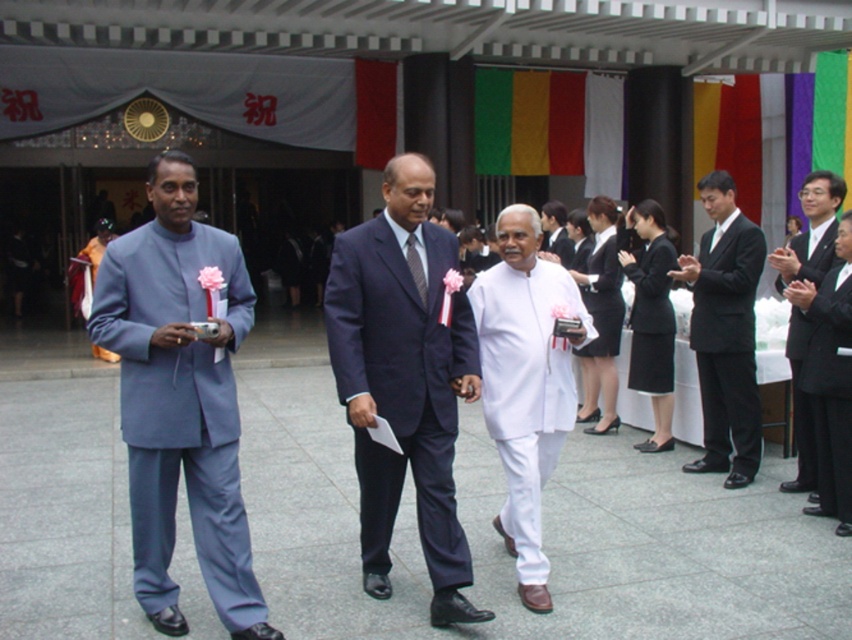
Does dark blue suit at center appear on the right side of black smooth suit at right?

No, dark blue suit at center is not to the right of black smooth suit at right.

Is point (361, 477) farther from camera compared to point (815, 408)?

No, it is in front of (815, 408).

The height and width of the screenshot is (640, 852). Find the location of `dark blue suit at center`. dark blue suit at center is located at coordinates (404, 380).

Does white cotton kurta at center appear on the right side of black smooth suit at right?

No, white cotton kurta at center is not to the right of black smooth suit at right.

Who is lower down, white cotton kurta at center or black smooth suit at right?

Positioned lower is black smooth suit at right.

Where is `white cotton kurta at center`? The image size is (852, 640). white cotton kurta at center is located at coordinates (527, 381).

Where is `white cotton kurta at center`? white cotton kurta at center is located at coordinates (527, 381).

Does point (360, 540) come in front of point (557, 408)?

Yes, it is.

Which of these two, dark blue suit at center or white cotton kurta at center, stands shorter?

Standing shorter between the two is white cotton kurta at center.

Is point (421, 520) positioned in front of point (548, 436)?

Yes, point (421, 520) is closer to viewer.

What are the coordinates of `dark blue suit at center` in the screenshot? It's located at (404, 380).